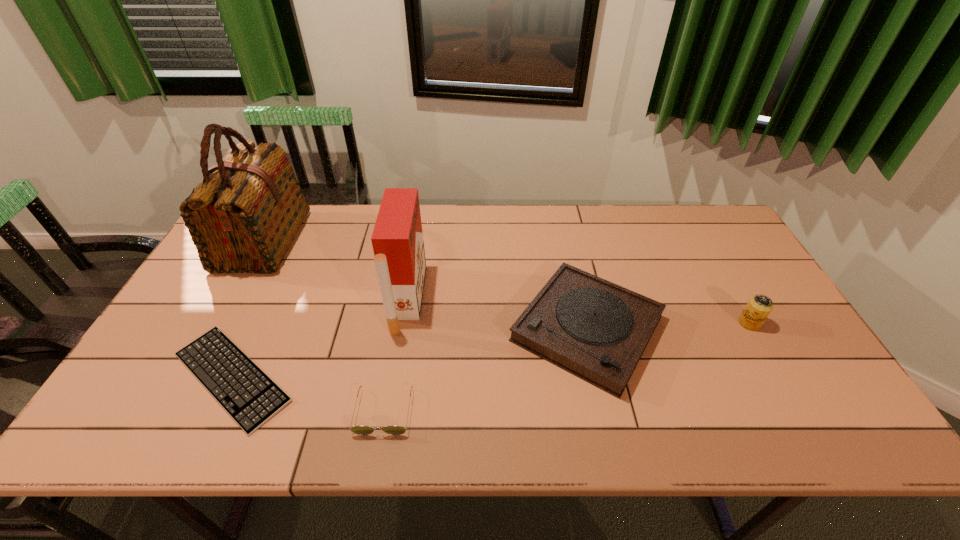
Where is `vacant space that satisfies the following two spatial constraints: 1. on the open handle side of the tallest object; 2. on the back side of the second object from right to left`? This screenshot has width=960, height=540. vacant space that satisfies the following two spatial constraints: 1. on the open handle side of the tallest object; 2. on the back side of the second object from right to left is located at coordinates (215, 329).

Find the location of a particular element. The height and width of the screenshot is (540, 960). vacant area in the image that satisfies the following two spatial constraints: 1. on the open handle side of the phonograph record; 2. on the right side of the shopping bag is located at coordinates (215, 329).

Image resolution: width=960 pixels, height=540 pixels. I want to click on vacant position in the image that satisfies the following two spatial constraints: 1. on the front-facing side of the cigarette case; 2. on the back side of the fifth object from left to right, so click(x=402, y=329).

Find the location of a particular element. The image size is (960, 540). vacant space that satisfies the following two spatial constraints: 1. on the back side of the fourth shortest object; 2. on the right side of the phonograph record is located at coordinates (586, 323).

The image size is (960, 540). I want to click on vacant region that satisfies the following two spatial constraints: 1. on the back side of the beer can; 2. on the left side of the shortest object, so click(257, 323).